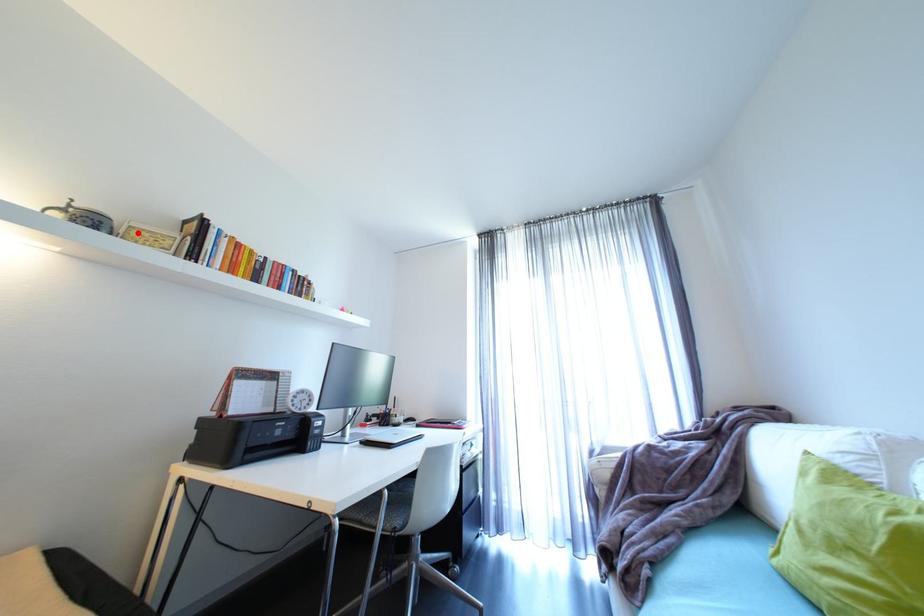
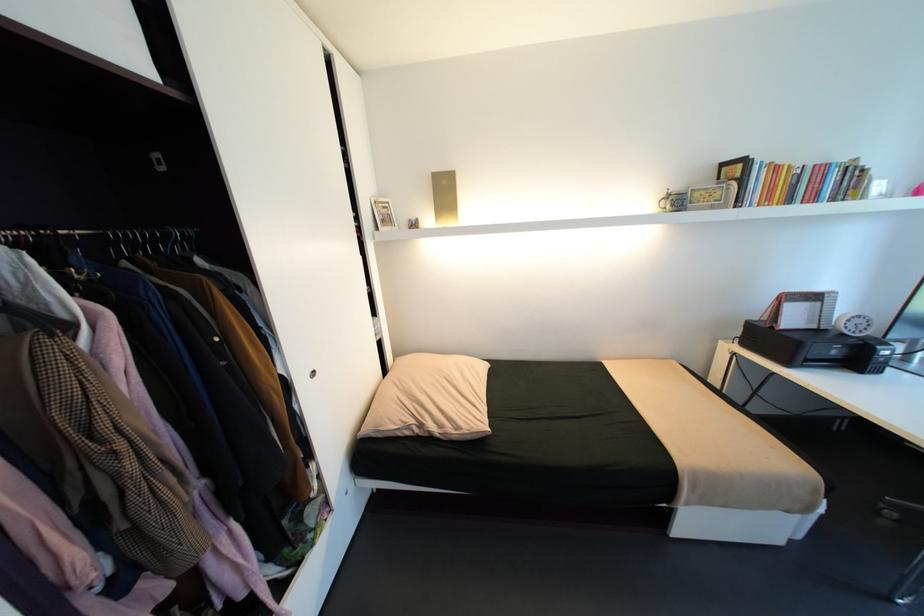
Where in the second image is the point corresponding to the highlighted location from the first image?

(700, 196)